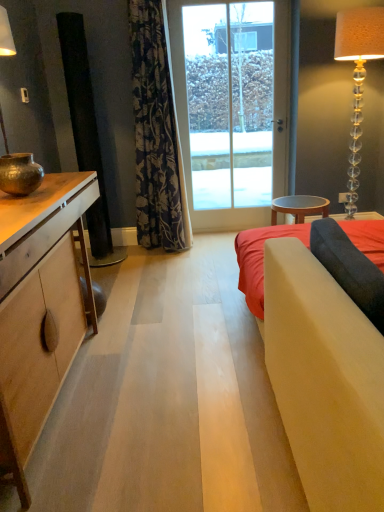
Question: Does dark floral fabric curtain at center appear on the left side of matte wood cabinet at left?

Choices:
 (A) yes
 (B) no

Answer: (B)

Question: Is dark floral fabric curtain at center oriented towards matte wood cabinet at left?

Choices:
 (A) no
 (B) yes

Answer: (A)

Question: Is dark floral fabric curtain at center closer to camera compared to matte wood cabinet at left?

Choices:
 (A) yes
 (B) no

Answer: (B)

Question: Does dark floral fabric curtain at center have a greater height compared to matte wood cabinet at left?

Choices:
 (A) no
 (B) yes

Answer: (B)

Question: Can you see dark floral fabric curtain at center touching matte wood cabinet at left?

Choices:
 (A) no
 (B) yes

Answer: (A)

Question: Is clear glass floor lamp at right taller or shorter than matte wood cabinet at left?

Choices:
 (A) tall
 (B) short

Answer: (A)

Question: From a real-world perspective, is clear glass floor lamp at right above or below matte wood cabinet at left?

Choices:
 (A) below
 (B) above

Answer: (B)

Question: Relative to matte wood cabinet at left, is clear glass floor lamp at right in front or behind?

Choices:
 (A) behind
 (B) front

Answer: (A)

Question: Does point (375, 20) appear closer or farther from the camera than point (69, 175)?

Choices:
 (A) closer
 (B) farther

Answer: (B)

Question: Based on their positions, is velvet gray pillow at right located to the left or right of clear glass floor lamp at right?

Choices:
 (A) right
 (B) left

Answer: (B)

Question: From the image's perspective, relative to clear glass floor lamp at right, is velvet gray pillow at right above or below?

Choices:
 (A) above
 (B) below

Answer: (B)

Question: Is velvet gray pillow at right situated inside clear glass floor lamp at right or outside?

Choices:
 (A) inside
 (B) outside

Answer: (B)

Question: Is velvet gray pillow at right wider or thinner than clear glass floor lamp at right?

Choices:
 (A) wide
 (B) thin

Answer: (B)

Question: From a real-world perspective, relative to wooden stool at center, is clear glass floor lamp at right vertically above or below?

Choices:
 (A) above
 (B) below

Answer: (A)

Question: Considering the positions of clear glass floor lamp at right and wooden stool at center in the image, is clear glass floor lamp at right taller or shorter than wooden stool at center?

Choices:
 (A) tall
 (B) short

Answer: (A)